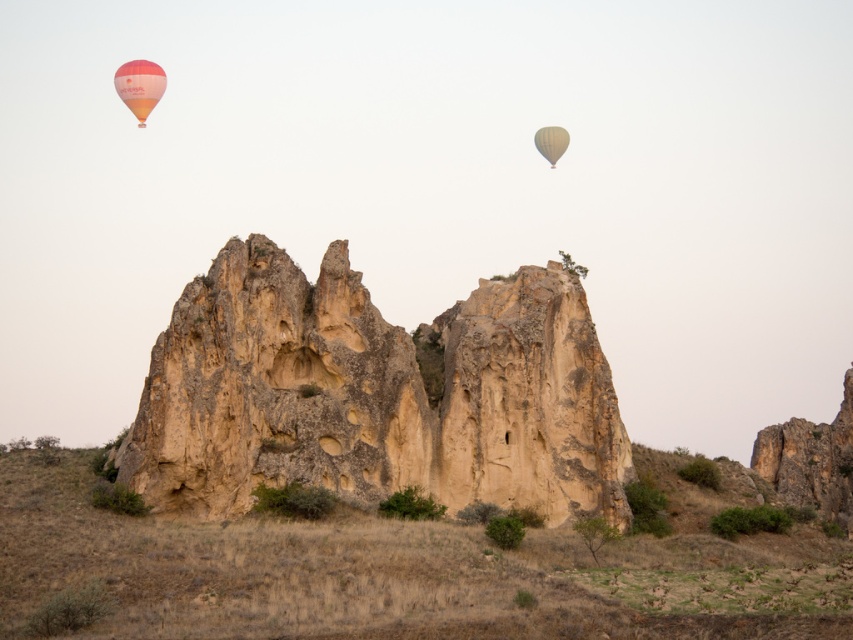
What do you see at coordinates (138, 86) in the screenshot? I see `matte orange balloon at upper left` at bounding box center [138, 86].

How much distance is there between matte orange balloon at upper left and matte yellow balloon at upper right?

matte orange balloon at upper left is 50.44 meters away from matte yellow balloon at upper right.

This screenshot has height=640, width=853. In order to click on matte orange balloon at upper left in this screenshot , I will do `click(138, 86)`.